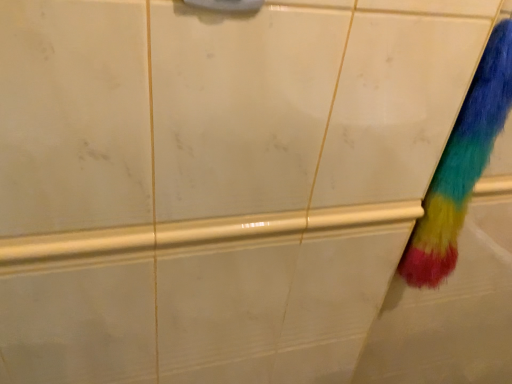
The width and height of the screenshot is (512, 384). What do you see at coordinates (461, 165) in the screenshot?
I see `multicolored fuzzy brush at right` at bounding box center [461, 165].

The width and height of the screenshot is (512, 384). I want to click on multicolored fuzzy brush at right, so click(x=461, y=165).

The height and width of the screenshot is (384, 512). I want to click on multicolored fuzzy brush at right, so click(461, 165).